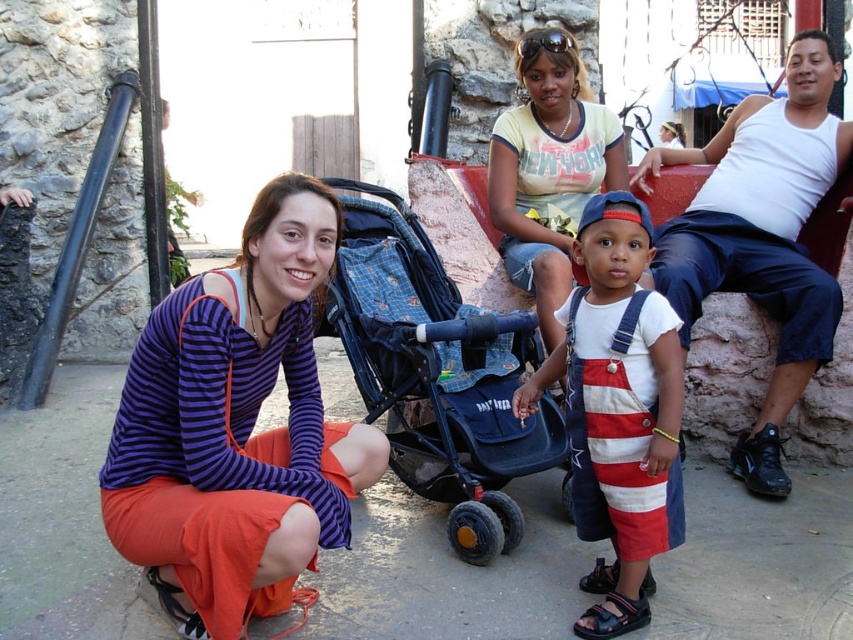
Question: Which of these objects is positioned farthest from the white tank top at upper right?

Choices:
 (A) black synthetic sandal at lower center
 (B) blue fabric stroller at center
 (C) striped denim overalls at center

Answer: (A)

Question: Does blue fabric stroller at center have a smaller size compared to yellow t-shirt at upper center?

Choices:
 (A) no
 (B) yes

Answer: (A)

Question: Which of the following is the closest to the observer?

Choices:
 (A) (750, 288)
 (B) (221, 275)
 (C) (607, 413)
 (D) (577, 58)

Answer: (B)

Question: Does blue fabric stroller at center have a lesser width compared to yellow t-shirt at upper center?

Choices:
 (A) yes
 (B) no

Answer: (B)

Question: Is white tank top at upper right bigger than striped denim overalls at center?

Choices:
 (A) yes
 (B) no

Answer: (A)

Question: Which point is closer to the camera?

Choices:
 (A) (488, 182)
 (B) (718, 241)
 (C) (227, 374)

Answer: (C)